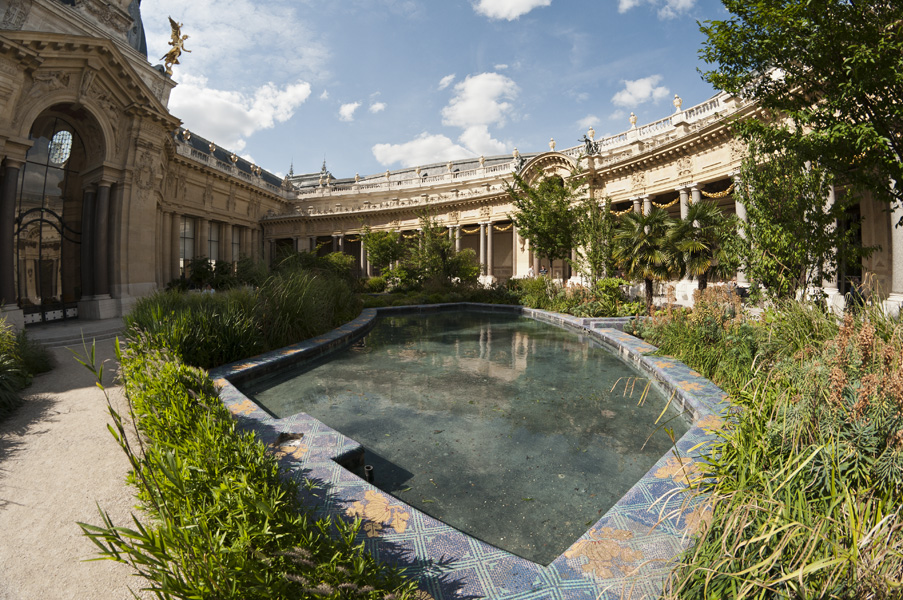
Where is `statue`? Image resolution: width=903 pixels, height=600 pixels. statue is located at coordinates (591, 146).